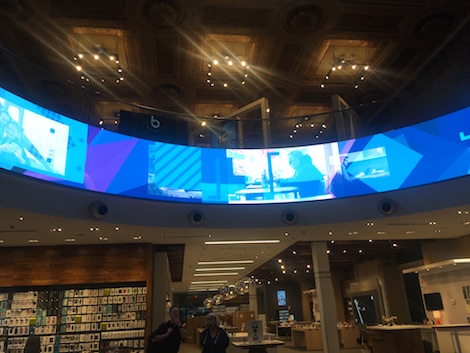
Find the location of a particular element. This screenshot has height=353, width=470. screen is located at coordinates (124, 169).